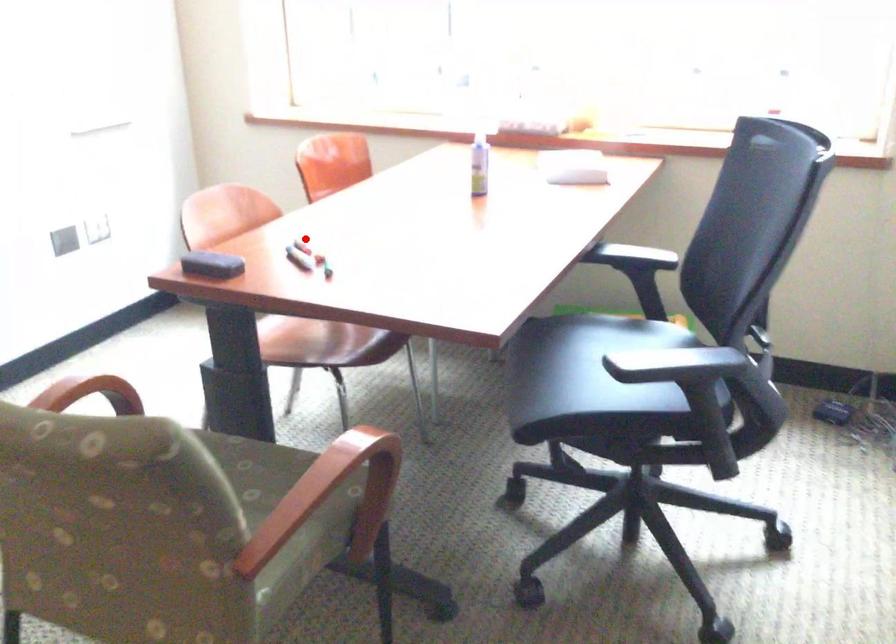
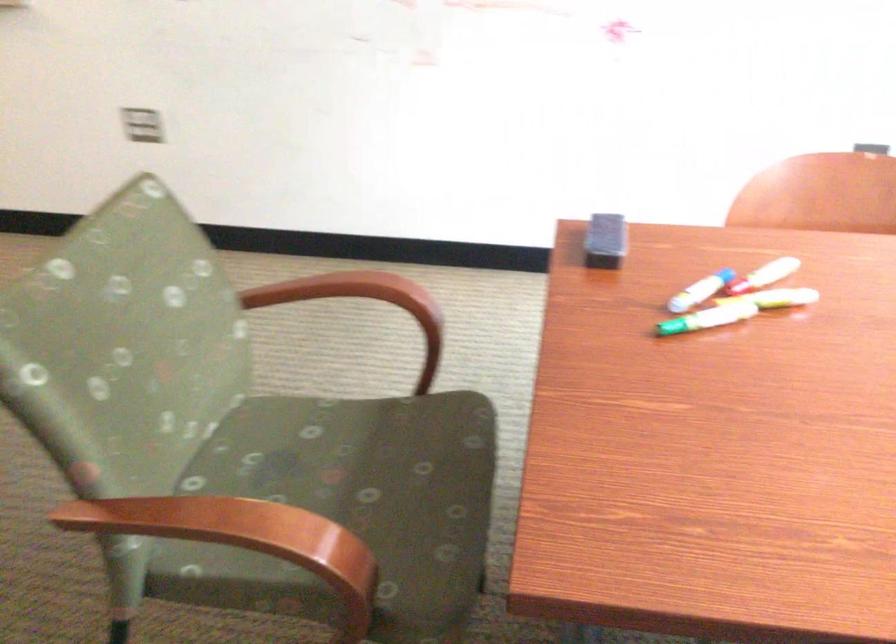
Locate, in the second image, the point that corresponds to the highlighted location in the first image.

(773, 270)